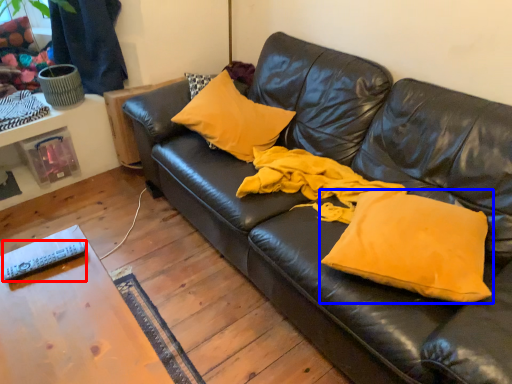
Question: Among these objects, which one is nearest to the camera, remote (highlighted by a red box) or pillow (highlighted by a blue box)?

Choices:
 (A) remote
 (B) pillow

Answer: (B)